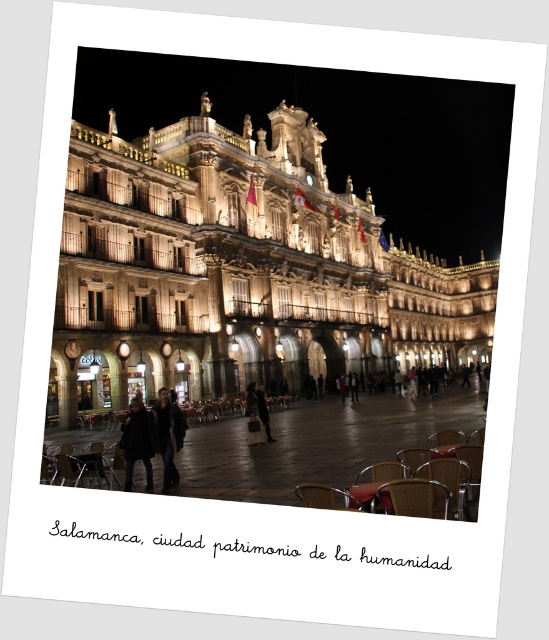
Who is lower down, illuminated stone palace at center or dark fabric coat at center?

dark fabric coat at center

Does illuminated stone palace at center have a larger size compared to dark fabric coat at center?

Yes, illuminated stone palace at center is bigger than dark fabric coat at center.

Is point (150, 132) behind point (130, 488)?

That is True.

At what (x,y) coordinates should I click in order to perform the action: click on illuminated stone palace at center. Please return your answer as a coordinate pair (x, y). This screenshot has width=549, height=640. Looking at the image, I should click on pos(239,269).

Is illuminated stone palace at center taller than brown woven chair at lower center?

Correct, illuminated stone palace at center is much taller as brown woven chair at lower center.

Does illuminated stone palace at center appear under brown woven chair at lower center?

Incorrect, illuminated stone palace at center is not positioned below brown woven chair at lower center.

Who is more forward, (x=86, y=285) or (x=407, y=513)?

Point (x=407, y=513)

Identify the location of illuminated stone palace at center. (239, 269).

From the picture: Does illuminated stone palace at center appear on the right side of wooden chair at lower right?

In fact, illuminated stone palace at center is to the left of wooden chair at lower right.

Which is behind, point (417, 256) or point (449, 486)?

Positioned behind is point (417, 256).

Who is more distant from viewer, (237, 253) or (466, 484)?

Point (237, 253)

The width and height of the screenshot is (549, 640). In order to click on illuminated stone palace at center in this screenshot , I will do click(239, 269).